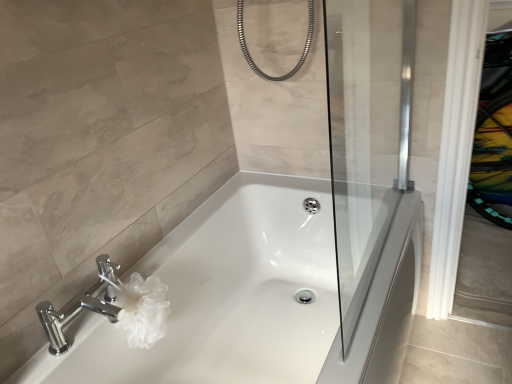
What is the approximate width of white glossy bathtub at center?

It is 27.00 inches.

Where is `chrome/metallic faucet at lower left`? chrome/metallic faucet at lower left is located at coordinates (82, 305).

The height and width of the screenshot is (384, 512). I want to click on white glossy bathtub at center, so click(254, 298).

From the image's perspective, is chrome/metallic faucet at lower left above or below transparent glass screen door at center?

From the image's perspective, chrome/metallic faucet at lower left appears below transparent glass screen door at center.

Is chrome/metallic faucet at lower left positioned with its back to transparent glass screen door at center?

That's not correct — chrome/metallic faucet at lower left is not looking away from transparent glass screen door at center.

Considering the relative positions of chrome/metallic faucet at lower left and transparent glass screen door at center in the image provided, is chrome/metallic faucet at lower left to the left of transparent glass screen door at center from the viewer's perspective?

Correct, you'll find chrome/metallic faucet at lower left to the left of transparent glass screen door at center.

From the picture: Can you confirm if chrome/metallic faucet at lower left is bigger than white glossy bathtub at center?

No.

Between chrome/metallic faucet at lower left and white glossy bathtub at center, which one has larger width?

With larger width is white glossy bathtub at center.

Could you tell me if chrome/metallic faucet at lower left is turned towards white glossy bathtub at center?

No, chrome/metallic faucet at lower left is not aimed at white glossy bathtub at center.

Is chrome/metallic faucet at lower left not near white glossy bathtub at center?

No, there isn't a large distance between chrome/metallic faucet at lower left and white glossy bathtub at center.

Is transparent glass screen door at center not within white glossy bathtub at center?

transparent glass screen door at center is positioned outside white glossy bathtub at center.

Considering the sizes of objects transparent glass screen door at center and white glossy bathtub at center in the image provided, who is wider, transparent glass screen door at center or white glossy bathtub at center?

white glossy bathtub at center is wider.

Does point (367, 1) come in front of point (221, 289)?

Yes, point (367, 1) is in front of point (221, 289).

Looking at this image, from a real-world perspective, is transparent glass screen door at center above or below white glossy bathtub at center?

transparent glass screen door at center is above white glossy bathtub at center.

From a real-world perspective, is white glossy bathtub at center above or below chrome/metallic faucet at lower left?

Clearly, from a real-world perspective, white glossy bathtub at center is below chrome/metallic faucet at lower left.

Can you confirm if white glossy bathtub at center is taller than chrome/metallic faucet at lower left?

Yes.

The width and height of the screenshot is (512, 384). In order to click on tap behind the white glossy bathtub at center in this screenshot , I will do `click(82, 305)`.

From the image's perspective, is white glossy bathtub at center on top of transparent glass screen door at center?

No.

Who is shorter, white glossy bathtub at center or transparent glass screen door at center?

With less height is white glossy bathtub at center.

How different are the orientations of white glossy bathtub at center and transparent glass screen door at center in degrees?

0.095 degrees separate the facing orientations of white glossy bathtub at center and transparent glass screen door at center.

How much distance is there between white glossy bathtub at center and transparent glass screen door at center?

white glossy bathtub at center and transparent glass screen door at center are 12.86 inches apart.

Which is more to the left, transparent glass screen door at center or chrome/metallic faucet at lower left?

chrome/metallic faucet at lower left is more to the left.

Can you see transparent glass screen door at center touching chrome/metallic faucet at lower left?

No, transparent glass screen door at center is not next to chrome/metallic faucet at lower left.

Which is in front, point (344, 58) or point (99, 292)?

Positioned in front is point (99, 292).

What are the coordinates of `screen door above the chrome/metallic faucet at lower left (from a real-world perspective)` in the screenshot? It's located at (367, 135).

You are a GUI agent. You are given a task and a screenshot of the screen. Output one action in this format:
    pyautogui.click(x=<x>, y=<y>)
    Task: Click on the bathtub located underneath the chrome/metallic faucet at lower left (from a real-world perspective)
    
    Given the screenshot: What is the action you would take?
    pyautogui.click(x=254, y=298)

Which object lies further to the anchor point white glossy bathtub at center, chrome/metallic faucet at lower left or transparent glass screen door at center?

chrome/metallic faucet at lower left is further to white glossy bathtub at center.

From the image, which object appears to be nearer to transparent glass screen door at center, chrome/metallic faucet at lower left or white glossy bathtub at center?

white glossy bathtub at center.

Which object lies nearer to the anchor point chrome/metallic faucet at lower left, transparent glass screen door at center or white glossy bathtub at center?

The object closer to chrome/metallic faucet at lower left is white glossy bathtub at center.

From the image, which object appears to be farther from transparent glass screen door at center, white glossy bathtub at center or chrome/metallic faucet at lower left?

Among the two, chrome/metallic faucet at lower left is located further to transparent glass screen door at center.

In the scene shown: Which object lies nearer to the anchor point chrome/metallic faucet at lower left, white glossy bathtub at center or transparent glass screen door at center?

white glossy bathtub at center.

From the image, which object appears to be nearer to white glossy bathtub at center, transparent glass screen door at center or chrome/metallic faucet at lower left?

The object closer to white glossy bathtub at center is transparent glass screen door at center.

This screenshot has width=512, height=384. In order to click on bathtub between chrome/metallic faucet at lower left and transparent glass screen door at center in this screenshot , I will do `click(254, 298)`.